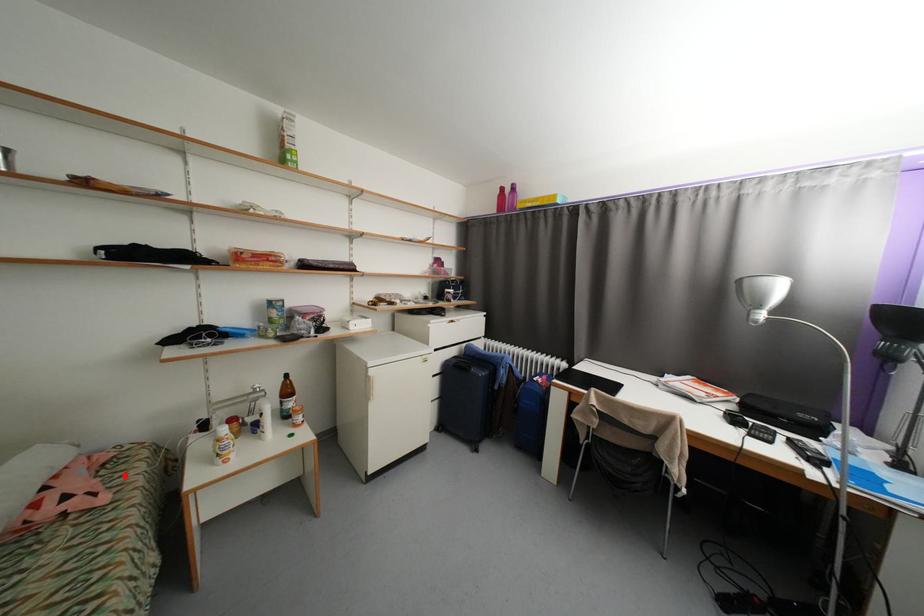
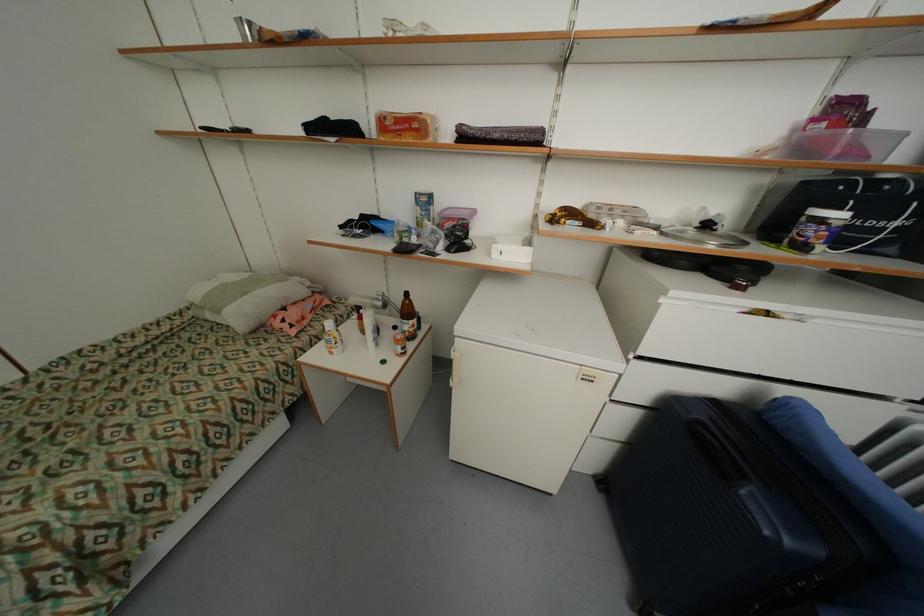
The point at the highlighted location is marked in the first image. Where is the corresponding point in the second image?

(327, 320)